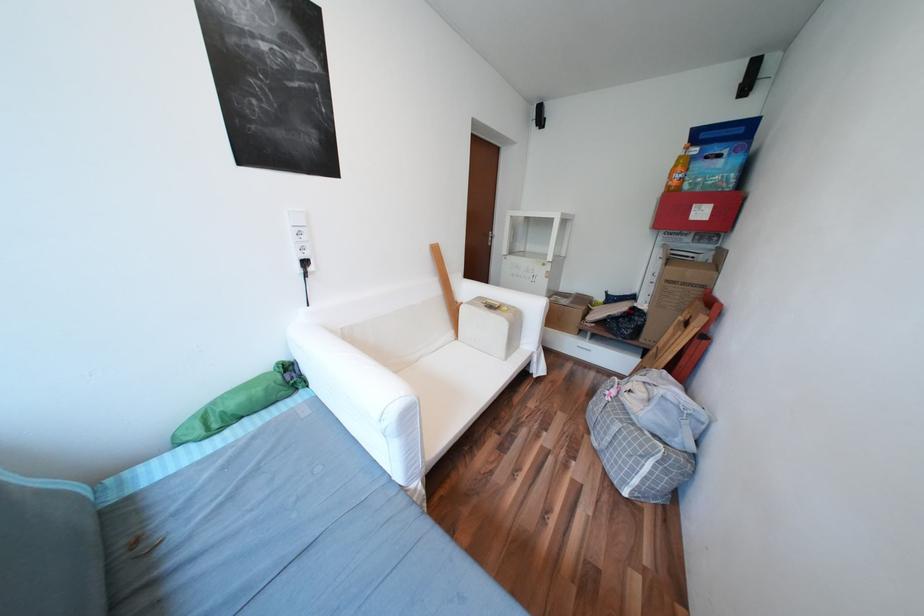
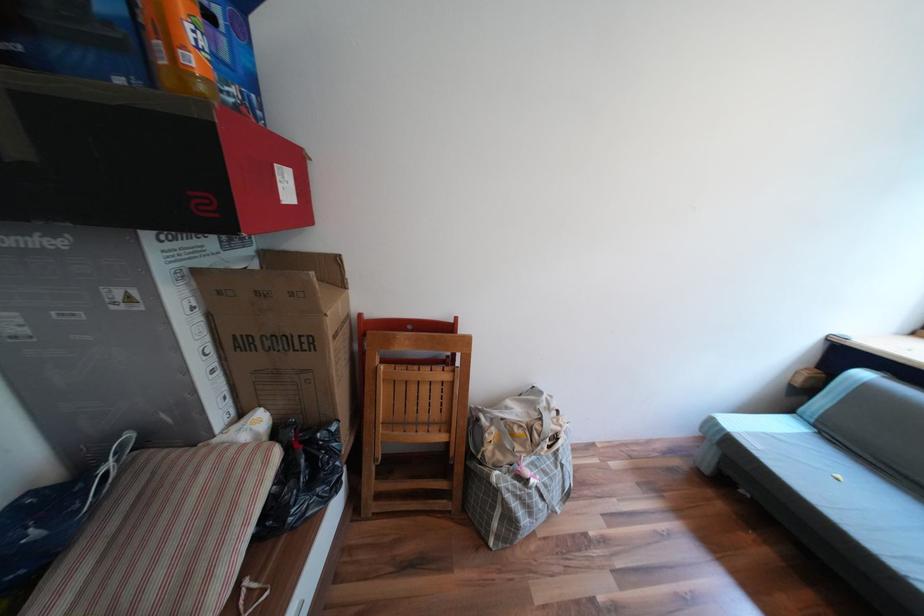
Find the pixel in the second image that matches point (701, 213) in the first image.

(289, 185)